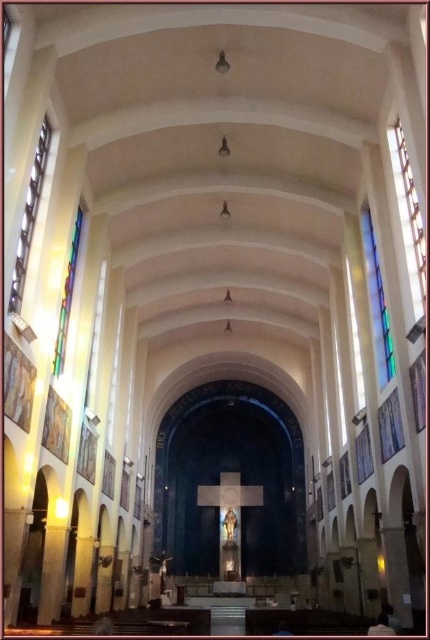
You are standing inside the church and want to take a photo of the stained glass window at right and the clear glass window at left. Which window is located to the right of the other?

The stained glass window at right is positioned on the right side of clear glass window at left.

You are an architect analyzing the church layout. You need to determine the vertical positioning of the stained glass window at right and the translucent stained glass at upper right. Which one is placed higher in the church?

The stained glass window at right is located above the translucent stained glass at upper right, so the stained glass window at right is placed higher in the church.